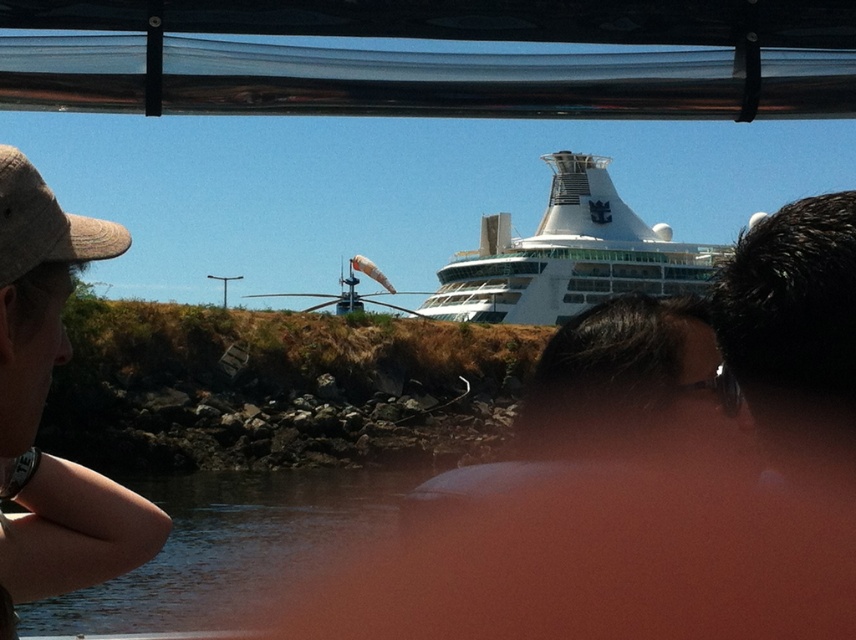
You are standing on the boat and want to look at two points in the scene. The first point is at coordinates point (195, 515) and the second is at point (498, 301). Which point is closer to you?

Point (195, 515) is in front of point (498, 301), so it is closer to you.

You are standing on the deck of the boat and see the brown fabric cap at left and the clear water at lower center. Which object is closer to you?

The brown fabric cap at left is closer to you because it is positioned over the clear water at lower center, indicating it is in front of it.